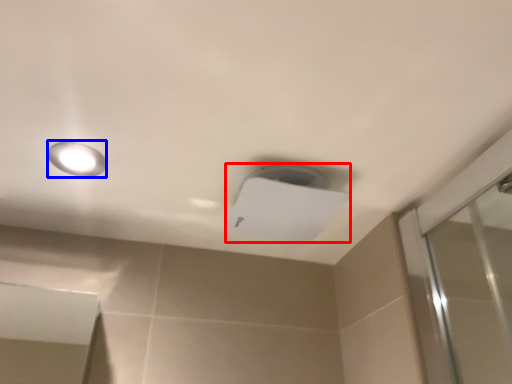
Question: Which of the following is the farthest to the observer, lamp (highlighted by a red box) or droplight (highlighted by a blue box)?

Choices:
 (A) lamp
 (B) droplight

Answer: (A)